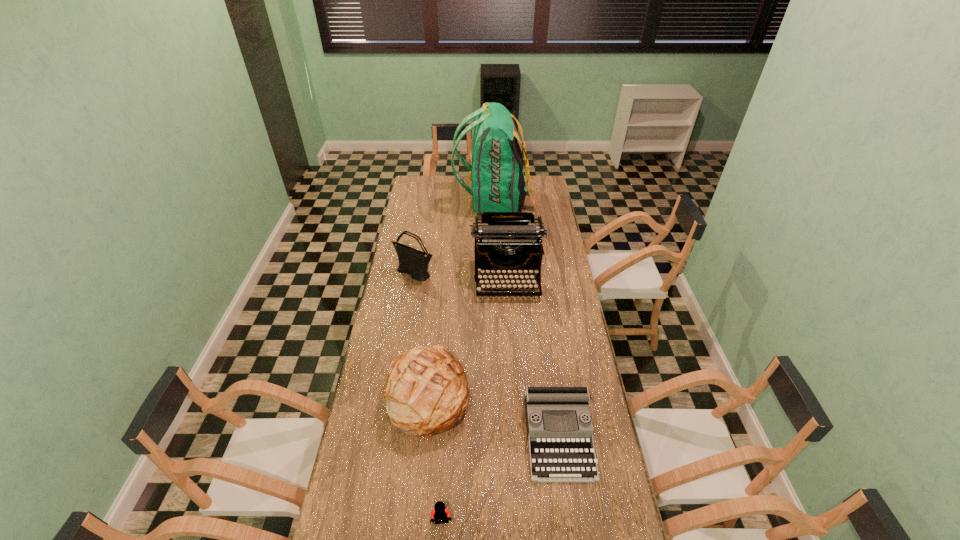
This screenshot has height=540, width=960. I want to click on vacant region that satisfies the following two spatial constraints: 1. on the front side of the bread; 2. on the left side of the shoulder bag, so click(x=396, y=393).

Find the location of a particular element. This screenshot has width=960, height=540. free space that satisfies the following two spatial constraints: 1. on the back of the tallest object; 2. on the front-facing side of the nearest object is located at coordinates (508, 522).